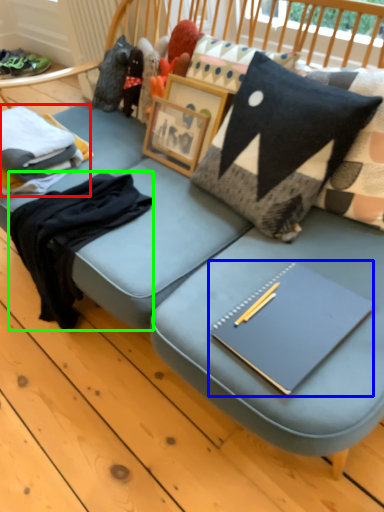
Question: Which object is the farthest from clothing (highlighted by a red box)? Choose among these: notebook (highlighted by a blue box) or clothing (highlighted by a green box).

Choices:
 (A) notebook
 (B) clothing

Answer: (A)